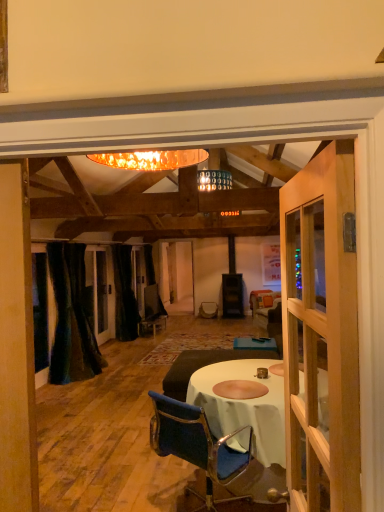
Question: From the image's perspective, is velvet blue chair at center above or below velvet dark green curtain at left, which is the 2th curtain in back-to-front order?

Choices:
 (A) above
 (B) below

Answer: (B)

Question: Is velvet blue chair at center bigger or smaller than velvet dark green curtain at left, marked as the 1th curtain in a front-to-back arrangement?

Choices:
 (A) big
 (B) small

Answer: (B)

Question: Which object is the closest to the velvet dark green curtain at left, which is the 2th curtain in back-to-front order?

Choices:
 (A) velvet blue chair at center
 (B) black velvet curtain at center, which ranks as the first curtain in back-to-front order
 (C) wooden door at right
 (D) velvet dark brown couch at center

Answer: (B)

Question: Considering the real-world distances, which object is closest to the wooden door at right?

Choices:
 (A) velvet dark green curtain at left, which is the 2th curtain in back-to-front order
 (B) velvet blue chair at center
 (C) velvet dark brown couch at center
 (D) black velvet curtain at center, which ranks as the first curtain in back-to-front order

Answer: (B)